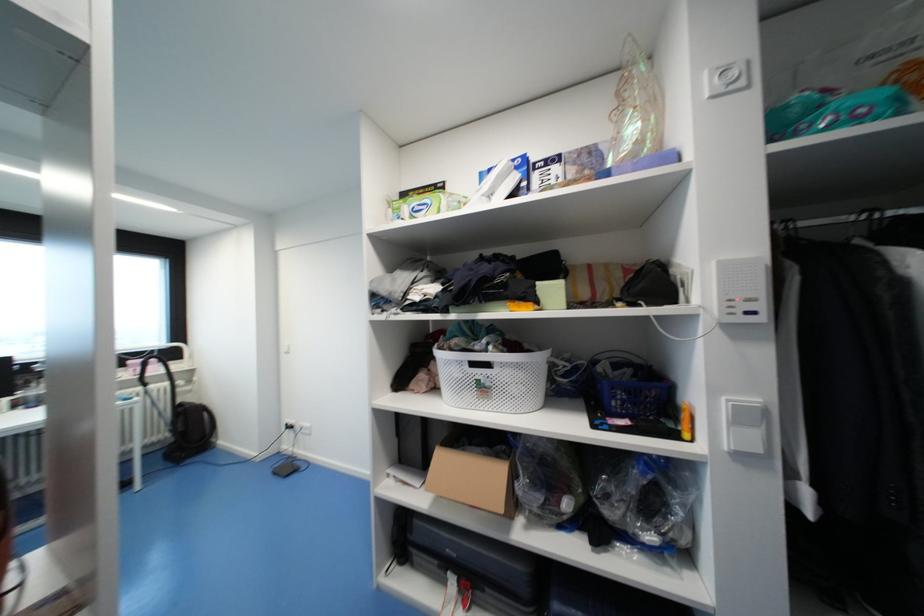
Where would you press the intercom button? Please return your answer as a coordinate pair (x, y).

(742, 291)